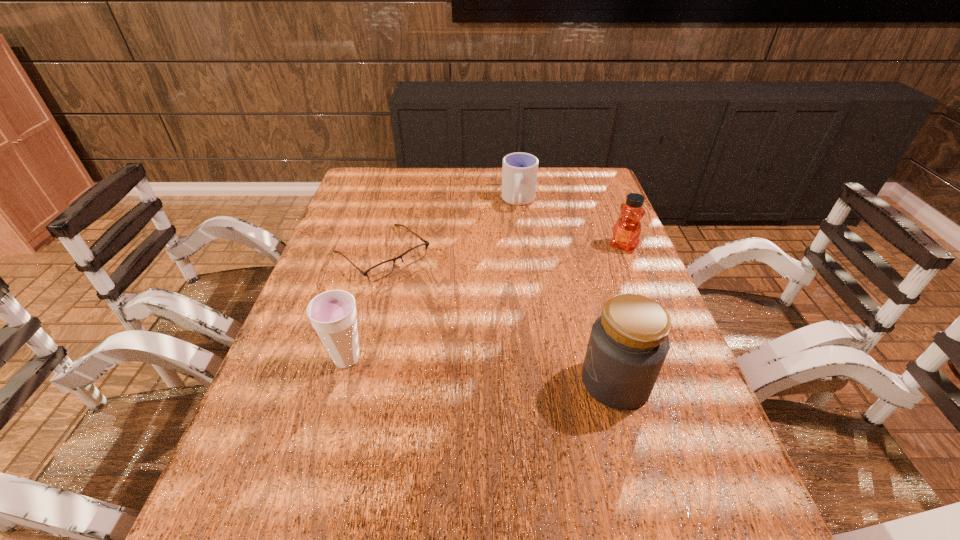
Where is `free space on the desktop that is between the left cup and the tallest object and is positioned with the handle on the side of the farther cup`? This screenshot has width=960, height=540. free space on the desktop that is between the left cup and the tallest object and is positioned with the handle on the side of the farther cup is located at coordinates (471, 370).

The height and width of the screenshot is (540, 960). I want to click on free spot on the desktop that is between the taller cup and the tallest object and is positioned on the front-facing side of the spectacles, so click(515, 374).

Image resolution: width=960 pixels, height=540 pixels. I want to click on free spot on the desktop that is between the left cup and the second object from right to left and is positioned on the front label of the rightmost object, so click(x=518, y=374).